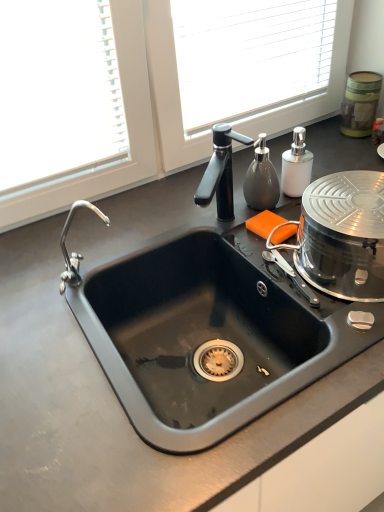
Locate an element on the screen. This screenshot has height=512, width=384. black matte sink at center is located at coordinates (208, 333).

Is point (327, 222) more distant than point (305, 177)?

No, (327, 222) is in front of (305, 177).

Is shiny metallic steamer at right, which ranks as the first appliance in front-to-back order, facing towards white matte soap dispenser at upper right?

No, shiny metallic steamer at right, which ranks as the first appliance in front-to-back order, is not facing towards white matte soap dispenser at upper right.

Considering the positions of objects shiny metallic steamer at right, the first appliance in the bottom-to-top sequence, and white matte soap dispenser at upper right in the image provided, who is in front, shiny metallic steamer at right, the first appliance in the bottom-to-top sequence, or white matte soap dispenser at upper right?

Positioned in front is shiny metallic steamer at right, the first appliance in the bottom-to-top sequence.

Is point (299, 159) more distant than point (211, 384)?

That is True.

Can we say white matte soap dispenser at upper right lies outside black matte sink at center?

Yes, white matte soap dispenser at upper right is outside of black matte sink at center.

The height and width of the screenshot is (512, 384). What are the coordinates of `sink to the left of white matte soap dispenser at upper right` in the screenshot? It's located at (208, 333).

The width and height of the screenshot is (384, 512). I want to click on soap dispenser in front of the green textured canister at upper right, the second appliance positioned from the front, so click(x=296, y=165).

Measure the distance between green textured canister at upper right, which is the first appliance in top-to-bottom order, and white matte soap dispenser at upper right.

green textured canister at upper right, which is the first appliance in top-to-bottom order, and white matte soap dispenser at upper right are 11.62 inches apart.

Considering the relative sizes of green textured canister at upper right, acting as the 2th appliance starting from the bottom, and white matte soap dispenser at upper right in the image provided, is green textured canister at upper right, acting as the 2th appliance starting from the bottom, thinner than white matte soap dispenser at upper right?

No.

How many degrees apart are the facing directions of black matte sink at center and shiny metallic steamer at right, which appears as the second appliance when viewed from the back?

black matte sink at center and shiny metallic steamer at right, which appears as the second appliance when viewed from the back, are facing 3.3 degrees away from each other.

From the picture: Is black matte sink at center oriented towards shiny metallic steamer at right, which ranks as the first appliance in front-to-back order?

No.

Measure the distance from black matte sink at center to shiny metallic steamer at right, which appears as the second appliance when viewed from the back.

A distance of 7.81 inches exists between black matte sink at center and shiny metallic steamer at right, which appears as the second appliance when viewed from the back.

Is black matte sink at center not near shiny metallic steamer at right, the first appliance in the bottom-to-top sequence?

No, there isn't a large distance between black matte sink at center and shiny metallic steamer at right, the first appliance in the bottom-to-top sequence.

From their relative heights in the image, would you say white matte soap dispenser at upper right is taller or shorter than shiny metallic steamer at right, which appears as the second appliance when viewed from the back?

Clearly, white matte soap dispenser at upper right is taller compared to shiny metallic steamer at right, which appears as the second appliance when viewed from the back.

In the image, is white matte soap dispenser at upper right on the left side or the right side of shiny metallic steamer at right, the first appliance in the bottom-to-top sequence?

white matte soap dispenser at upper right is to the left of shiny metallic steamer at right, the first appliance in the bottom-to-top sequence.

From the image's perspective, which object appears higher, white matte soap dispenser at upper right or shiny metallic steamer at right, which appears as the second appliance when viewed from the back?

white matte soap dispenser at upper right.

Which is in front, white matte soap dispenser at upper right or shiny metallic steamer at right, which ranks as the first appliance in front-to-back order?

shiny metallic steamer at right, which ranks as the first appliance in front-to-back order, is closer to the camera.

Which object is positioned more to the left, shiny metallic steamer at right, which ranks as the first appliance in front-to-back order, or black matte sink at center?

From the viewer's perspective, black matte sink at center appears more on the left side.

Does shiny metallic steamer at right, the first appliance in the bottom-to-top sequence, turn towards black matte sink at center?

No, shiny metallic steamer at right, the first appliance in the bottom-to-top sequence, does not turn towards black matte sink at center.

How different are the orientations of shiny metallic steamer at right, the first appliance in the bottom-to-top sequence, and black matte sink at center in degrees?

The angular difference between shiny metallic steamer at right, the first appliance in the bottom-to-top sequence, and black matte sink at center is 3.3 degrees.

How far apart are shiny metallic steamer at right, which appears as the second appliance when viewed from the back, and black matte sink at center?

shiny metallic steamer at right, which appears as the second appliance when viewed from the back, is 7.81 inches from black matte sink at center.

Considering the relative positions of green textured canister at upper right, the first appliance in the back-to-front sequence, and black matte sink at center in the image provided, is green textured canister at upper right, the first appliance in the back-to-front sequence, to the left or to the right of black matte sink at center?

green textured canister at upper right, the first appliance in the back-to-front sequence, is positioned on black matte sink at center's right side.

From a real-world perspective, between green textured canister at upper right, acting as the 2th appliance starting from the bottom, and black matte sink at center, who is vertically lower?

black matte sink at center.

From the image's perspective, which is below, green textured canister at upper right, which is the first appliance in top-to-bottom order, or black matte sink at center?

black matte sink at center is shown below in the image.

Where is `soap dispenser on the left of the shiny metallic steamer at right, which appears as the second appliance when viewed from the back`? The image size is (384, 512). soap dispenser on the left of the shiny metallic steamer at right, which appears as the second appliance when viewed from the back is located at coordinates (296, 165).

At what (x,y) coordinates should I click in order to perform the action: click on soap dispenser above the black matte sink at center (from a real-world perspective). Please return your answer as a coordinate pair (x, y). The image size is (384, 512). Looking at the image, I should click on (296, 165).

Considering their positions, is black matte sink at center positioned closer to white matte soap dispenser at upper right than shiny metallic steamer at right, which appears as the second appliance when viewed from the back?

Among the two, shiny metallic steamer at right, which appears as the second appliance when viewed from the back, is located nearer to white matte soap dispenser at upper right.

When comparing their distances from black matte sink at center, does green textured canister at upper right, the first appliance in the back-to-front sequence, or white matte soap dispenser at upper right seem further?

green textured canister at upper right, the first appliance in the back-to-front sequence.

Estimate the real-world distances between objects in this image. Which object is closer to shiny metallic steamer at right, the 2th appliance viewed from the top, black matte sink at center or white matte soap dispenser at upper right?

black matte sink at center is closer to shiny metallic steamer at right, the 2th appliance viewed from the top.

Looking at the image, which one is located further to white matte soap dispenser at upper right, shiny metallic steamer at right, which ranks as the first appliance in front-to-back order, or green textured canister at upper right, acting as the 2th appliance starting from the bottom?

Among the two, green textured canister at upper right, acting as the 2th appliance starting from the bottom, is located further to white matte soap dispenser at upper right.

When comparing their distances from green textured canister at upper right, the first appliance in the back-to-front sequence, does white matte soap dispenser at upper right or black matte sink at center seem further?

Among the two, black matte sink at center is located further to green textured canister at upper right, the first appliance in the back-to-front sequence.

Estimate the real-world distances between objects in this image. Which object is further from shiny metallic steamer at right, the 2th appliance viewed from the top, white matte soap dispenser at upper right or green textured canister at upper right, the second appliance positioned from the front?

green textured canister at upper right, the second appliance positioned from the front, is positioned further to the anchor shiny metallic steamer at right, the 2th appliance viewed from the top.

Looking at the image, which one is located closer to black matte sink at center, white matte soap dispenser at upper right or shiny metallic steamer at right, which ranks as the first appliance in front-to-back order?

shiny metallic steamer at right, which ranks as the first appliance in front-to-back order, lies closer to black matte sink at center than the other object.

Which object lies further to the anchor point green textured canister at upper right, the first appliance in the back-to-front sequence, shiny metallic steamer at right, which ranks as the first appliance in front-to-back order, or black matte sink at center?

Based on the image, black matte sink at center appears to be further to green textured canister at upper right, the first appliance in the back-to-front sequence.

Identify the location of appliance between black matte sink at center and white matte soap dispenser at upper right along the z-axis. (343, 236).

What are the coordinates of `soap dispenser between shiny metallic steamer at right, which appears as the second appliance when viewed from the back, and green textured canister at upper right, which is the first appliance in top-to-bottom order, in the front-back direction` in the screenshot? It's located at (296, 165).

Locate an element on the screen. This screenshot has width=384, height=512. soap dispenser between black matte sink at center and green textured canister at upper right, which is the first appliance in top-to-bottom order, along the z-axis is located at coordinates (296, 165).

Identify the location of appliance between black matte sink at center and green textured canister at upper right, which is the first appliance in top-to-bottom order, from front to back. The width and height of the screenshot is (384, 512). (343, 236).